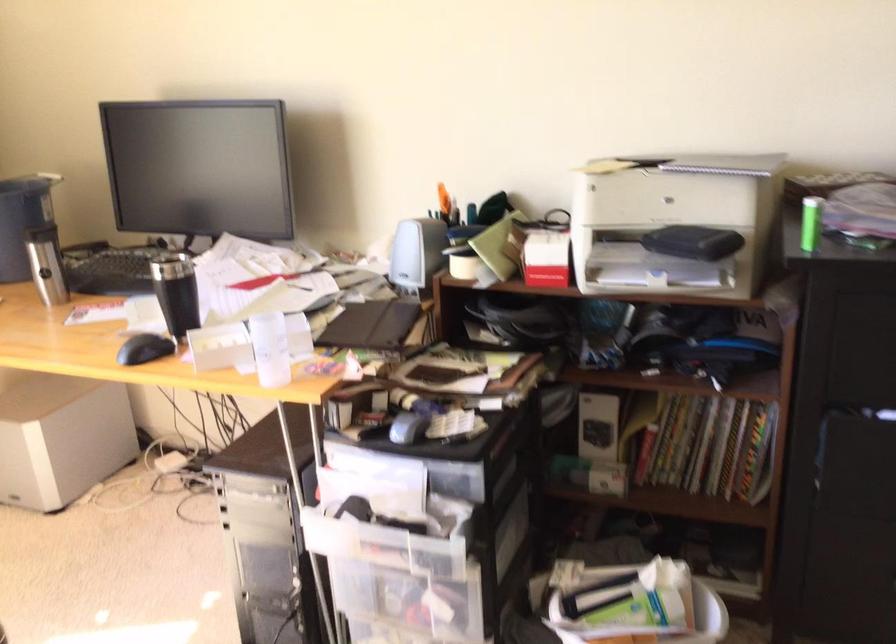
Describe the element at coordinates (383, 545) in the screenshot. I see `the white drawer handle` at that location.